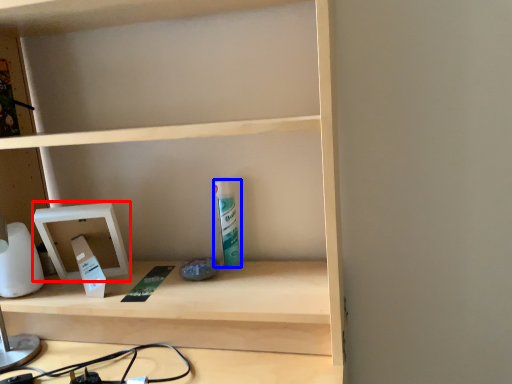
Question: Which object is further to the camera taking this photo, medicine cabinet (highlighted by a red box) or toiletry (highlighted by a blue box)?

Choices:
 (A) medicine cabinet
 (B) toiletry

Answer: (B)